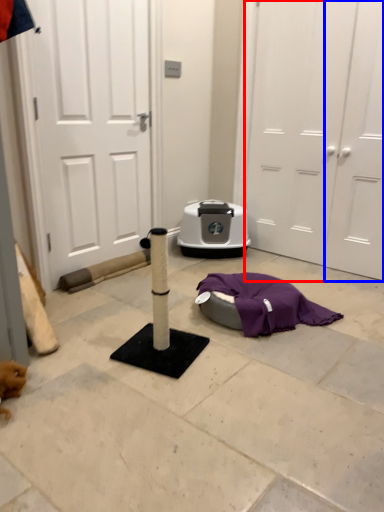
Question: Which of the following is the farthest to the observer, door (highlighted by a red box) or door (highlighted by a blue box)?

Choices:
 (A) door
 (B) door

Answer: (B)